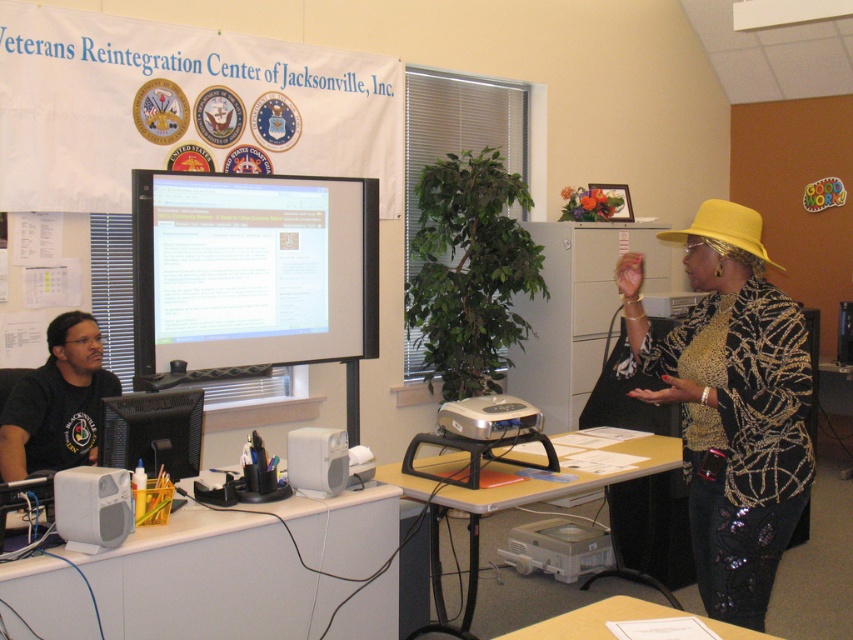
Does black matte shirt at left have a greater height compared to light brown wooden table at center?

Incorrect, black matte shirt at left's height is not larger of light brown wooden table at center's.

Based on the photo, who is more forward, (x=9, y=403) or (x=437, y=524)?

Point (x=9, y=403)

At what (x,y) coordinates should I click in order to perform the action: click on black matte shirt at left. Please return your answer as a coordinate pair (x, y). Looking at the image, I should click on (57, 403).

Which of these two, white plastic table at lower left or wooden table at lower center, stands taller?

white plastic table at lower left

Is white plastic table at lower left positioned at the back of wooden table at lower center?

Yes.

Find the location of a particular element. white plastic table at lower left is located at coordinates (209, 580).

Between sequined fabric jacket at center right and matte black monitor at center, which one appears on the left side from the viewer's perspective?

matte black monitor at center is more to the left.

At what (x,y) coordinates should I click in order to perform the action: click on sequined fabric jacket at center right. Please return your answer as a coordinate pair (x, y). Looking at the image, I should click on (730, 404).